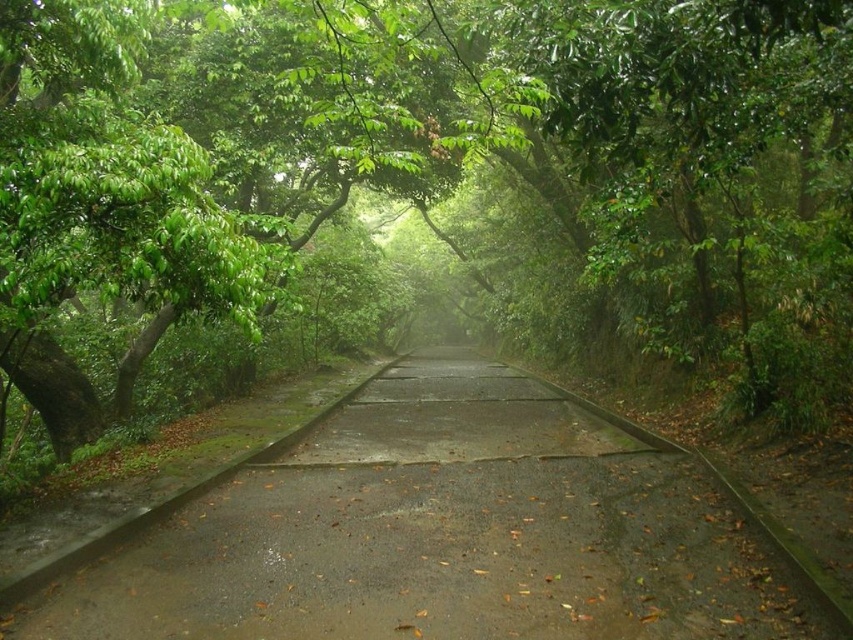
Looking at this image, which is more to the left, green leafy tree at center or concrete road at center?

From the viewer's perspective, green leafy tree at center appears more on the left side.

Is green leafy tree at center to the right of concrete road at center from the viewer's perspective?

No, green leafy tree at center is not to the right of concrete road at center.

Measure the distance between point (107, 132) and camera.

A distance of 5.66 meters exists between point (107, 132) and camera.

Locate an element on the screen. Image resolution: width=853 pixels, height=640 pixels. green leafy tree at center is located at coordinates (456, 150).